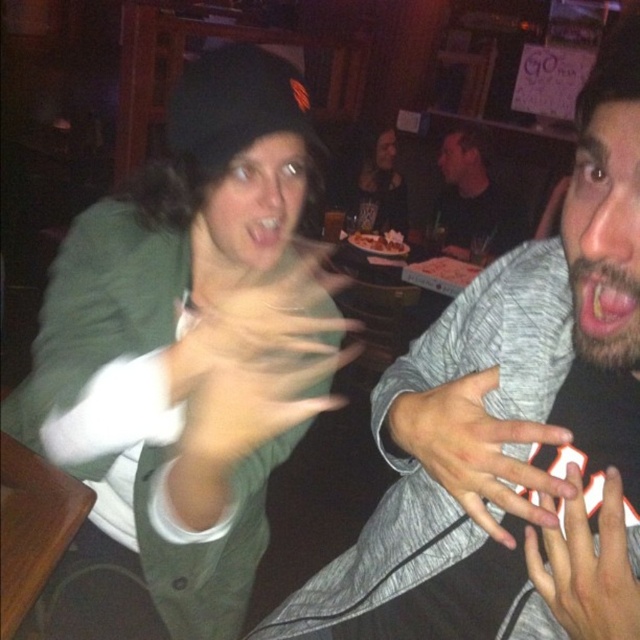
Which is above, white matte hand at center or black matte shirt at upper center?

black matte shirt at upper center is higher up.

Is white matte hand at center below black matte shirt at upper center?

Yes.

Which is behind, point (634, 592) or point (483, 236)?

The point (483, 236) is more distant.

Identify the location of white matte hand at center. (588, 566).

Does smooth gray hand at center have a lesser height compared to black matte shirt at upper center?

Yes.

This screenshot has height=640, width=640. I want to click on smooth gray hand at center, so click(x=476, y=451).

Can you confirm if smooth gray hand at center is positioned below smooth skin hand at center?

Correct, smooth gray hand at center is located below smooth skin hand at center.

Which is in front, point (500, 436) or point (282, 364)?

Positioned in front is point (500, 436).

Find the location of a particular element. smooth gray hand at center is located at coordinates (476, 451).